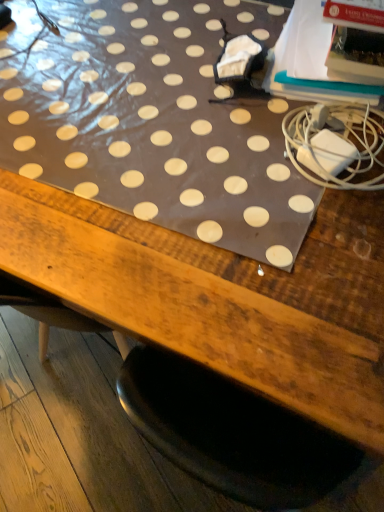
Locate an element on the screen. vacant space in white matte cable at upper right (from a real-world perspective) is located at coordinates (301, 139).